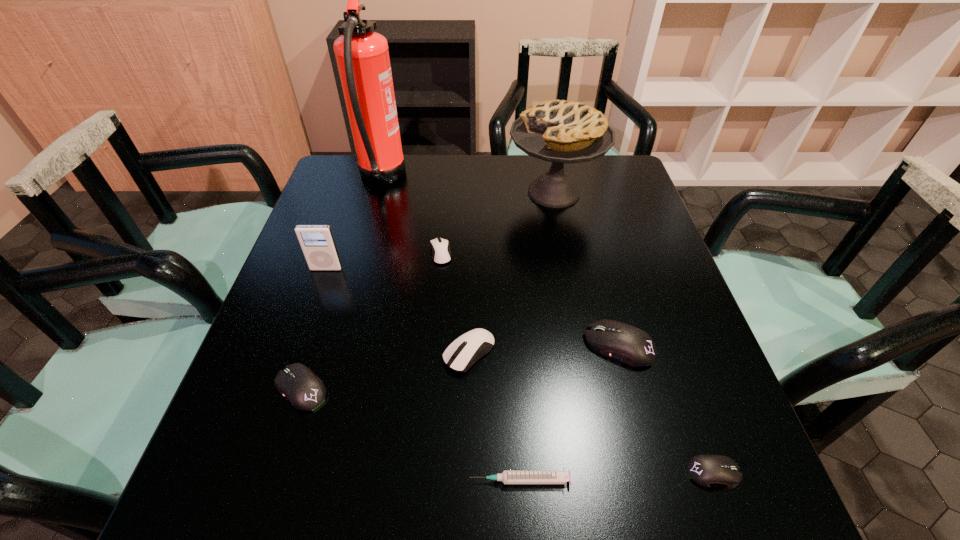
You are a GUI agent. You are given a task and a screenshot of the screen. Output one action in this format:
    pyautogui.click(x=<x>, y=<y>)
    Task: Click on the syringe at the near edge
    This screenshot has height=540, width=960.
    Given the screenshot: What is the action you would take?
    pyautogui.click(x=507, y=476)

Locate an element on the screen. The width and height of the screenshot is (960, 540). fire extinguisher present at the left edge is located at coordinates (362, 55).

You are a GUI agent. You are given a task and a screenshot of the screen. Output one action in this format:
    pyautogui.click(x=<x>, y=<y>)
    Task: Click on the iPod that is at the left edge
    This screenshot has height=540, width=960.
    Given the screenshot: What is the action you would take?
    pyautogui.click(x=317, y=242)

This screenshot has width=960, height=540. What are the coordinates of `computer equipment located at the left edge` in the screenshot? It's located at (305, 391).

I want to click on pie present at the right edge, so click(558, 131).

Identify the location of object that is at the far left corner. (362, 55).

Locate an element on the screen. object that is at the far right corner is located at coordinates tap(558, 131).

Locate an element on the screen. This screenshot has height=540, width=960. object situated at the near right corner is located at coordinates tap(706, 470).

The height and width of the screenshot is (540, 960). In order to click on vacant space at the far edge in this screenshot , I will do `click(487, 167)`.

Where is `free space at the near edge of the desktop`? This screenshot has width=960, height=540. free space at the near edge of the desktop is located at coordinates (433, 515).